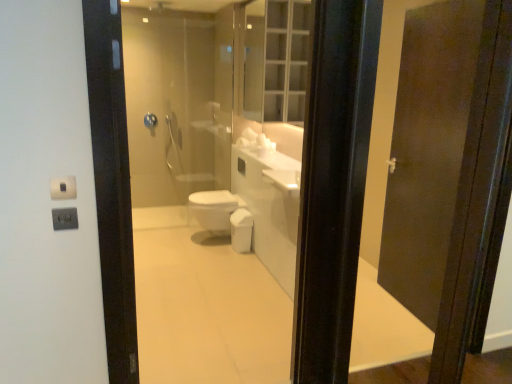
Question: From a real-world perspective, is blue plastic towel bar at upper center physically below white glossy bidet at center?

Choices:
 (A) yes
 (B) no

Answer: (B)

Question: From the image's perspective, is blue plastic towel bar at upper center on top of white glossy bidet at center?

Choices:
 (A) yes
 (B) no

Answer: (A)

Question: Is blue plastic towel bar at upper center aimed at white glossy bidet at center?

Choices:
 (A) no
 (B) yes

Answer: (A)

Question: Would you consider blue plastic towel bar at upper center to be distant from white glossy bidet at center?

Choices:
 (A) yes
 (B) no

Answer: (A)

Question: Does blue plastic towel bar at upper center have a greater width compared to white glossy bidet at center?

Choices:
 (A) yes
 (B) no

Answer: (B)

Question: Does blue plastic towel bar at upper center have a lesser height compared to white glossy bidet at center?

Choices:
 (A) yes
 (B) no

Answer: (A)

Question: Can you confirm if white glossy bidet at center is bigger than blue plastic towel bar at upper center?

Choices:
 (A) no
 (B) yes

Answer: (B)

Question: Does white glossy bidet at center contain blue plastic towel bar at upper center?

Choices:
 (A) no
 (B) yes

Answer: (A)

Question: Considering the relative sizes of white glossy bidet at center and blue plastic towel bar at upper center in the image provided, is white glossy bidet at center shorter than blue plastic towel bar at upper center?

Choices:
 (A) no
 (B) yes

Answer: (A)

Question: From the image's perspective, is white glossy bidet at center beneath blue plastic towel bar at upper center?

Choices:
 (A) no
 (B) yes

Answer: (B)

Question: Can you confirm if white glossy bidet at center is wider than blue plastic towel bar at upper center?

Choices:
 (A) no
 (B) yes

Answer: (B)

Question: Considering the relative sizes of white glossy bidet at center and blue plastic towel bar at upper center in the image provided, is white glossy bidet at center thinner than blue plastic towel bar at upper center?

Choices:
 (A) yes
 (B) no

Answer: (B)

Question: Considering the relative sizes of blue plastic towel bar at upper center and clear glass medicine cabinet at upper center in the image provided, is blue plastic towel bar at upper center smaller than clear glass medicine cabinet at upper center?

Choices:
 (A) no
 (B) yes

Answer: (B)